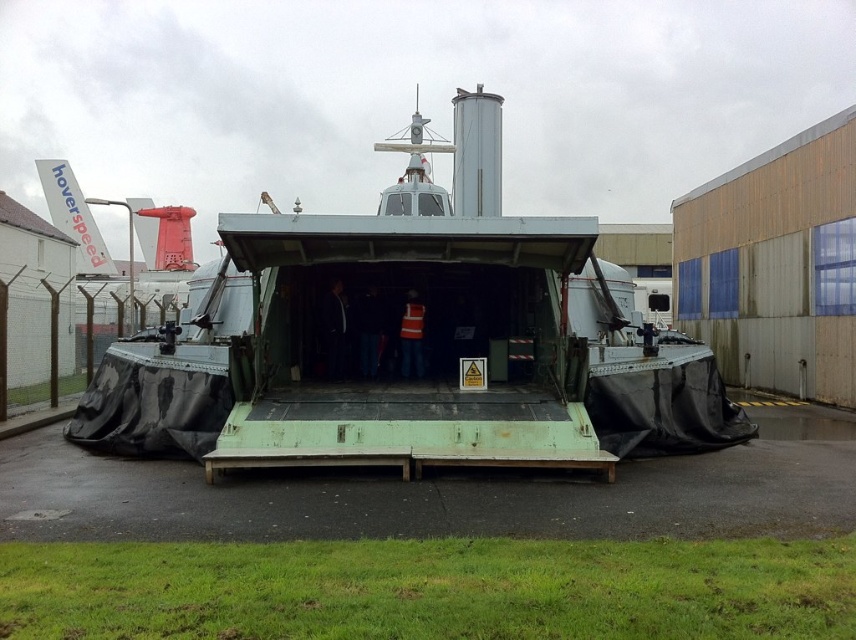
Which is in front, point (343, 316) or point (409, 378)?

Point (343, 316) is more forward.

Is point (331, 355) behind point (409, 342)?

Yes, point (331, 355) is farther from viewer.

Where is `reflective orange vest at center`? The height and width of the screenshot is (640, 856). reflective orange vest at center is located at coordinates [x=333, y=330].

How far apart are green matte hovercraft at center and orange reflective vest at center?

green matte hovercraft at center is 2.52 meters from orange reflective vest at center.

Can you confirm if green matte hovercraft at center is thinner than orange reflective vest at center?

No.

What do you see at coordinates (421, 340) in the screenshot? I see `green matte hovercraft at center` at bounding box center [421, 340].

Identify the location of green matte hovercraft at center. (421, 340).

Can you confirm if green matte hovercraft at center is positioned to the right of reflective orange vest at center?

Correct, you'll find green matte hovercraft at center to the right of reflective orange vest at center.

Can you confirm if green matte hovercraft at center is wider than reflective orange vest at center?

Yes, green matte hovercraft at center is wider than reflective orange vest at center.

This screenshot has height=640, width=856. Describe the element at coordinates (421, 340) in the screenshot. I see `green matte hovercraft at center` at that location.

The width and height of the screenshot is (856, 640). In order to click on green matte hovercraft at center in this screenshot , I will do `click(421, 340)`.